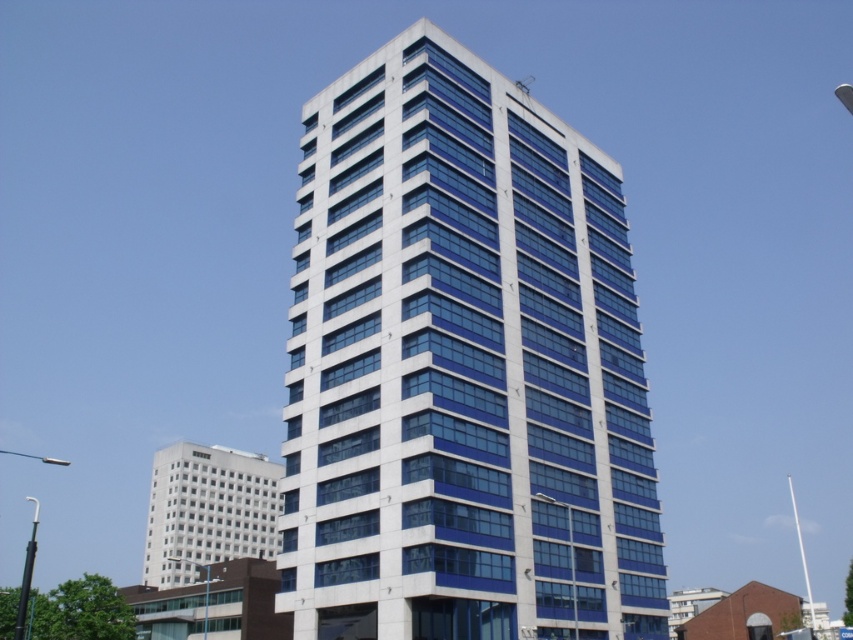
Question: Is white glass building at center wider than white glass building at lower left?

Choices:
 (A) no
 (B) yes

Answer: (A)

Question: Which point is farther to the camera?

Choices:
 (A) white glass building at center
 (B) white glass building at lower left

Answer: (B)

Question: Observing the image, what is the correct spatial positioning of white glass building at center in reference to white glass building at lower left?

Choices:
 (A) below
 (B) above

Answer: (B)

Question: Which object appears closest to the camera in this image?

Choices:
 (A) white glass building at lower left
 (B) white glass building at center

Answer: (B)

Question: Does white glass building at center appear over white glass building at lower left?

Choices:
 (A) yes
 (B) no

Answer: (A)

Question: Among these objects, which one is nearest to the camera?

Choices:
 (A) white glass building at lower left
 (B) white glass building at center

Answer: (B)